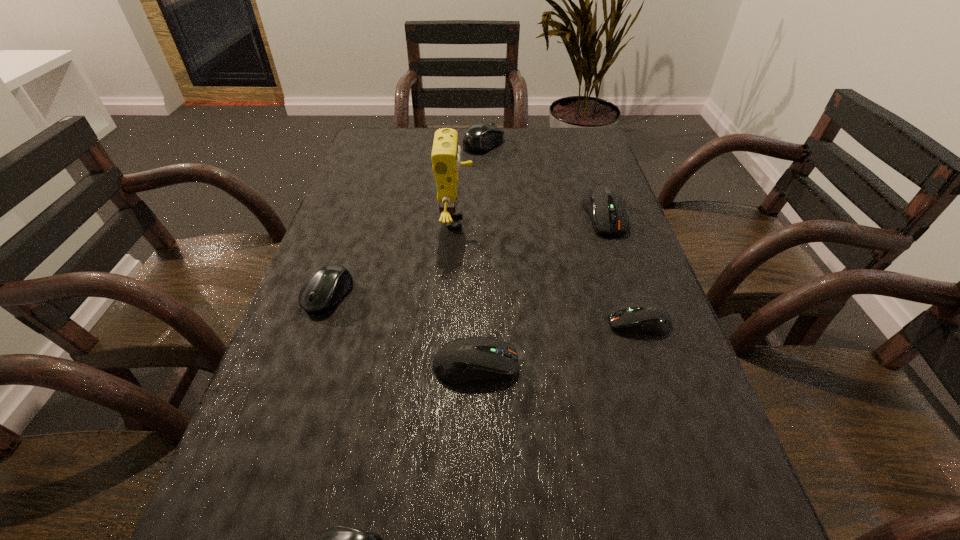
Locate which object is the sixth closest to the second black mouse from left to right. Please provide its 2D coordinates. Your answer should be formatted as a tuple, i.e. [(x, y)], where the tuple contains the x and y coordinates of a point satisfying the conditions above.

[(480, 137)]

Locate which object ranks sixth in proximity to the sponge. Please provide its 2D coordinates. Your answer should be formatted as a tuple, i.e. [(x, y)], where the tuple contains the x and y coordinates of a point satisfying the conditions above.

[(339, 539)]

Image resolution: width=960 pixels, height=540 pixels. What are the coordinates of `mouse that is the third nearest to the second nearest dark computer equipment` in the screenshot? It's located at 339,539.

Locate which mouse is the fourth closest to the tallest object. Please provide its 2D coordinates. Your answer should be formatted as a tuple, i.e. [(x, y)], where the tuple contains the x and y coordinates of a point satisfying the conditions above.

[(606, 207)]

The image size is (960, 540). Find the location of `black mouse that can be found as the second closest to the leftmost dark computer equipment`. black mouse that can be found as the second closest to the leftmost dark computer equipment is located at coordinates (339, 539).

At what (x,y) coordinates should I click in order to perform the action: click on the closest black mouse relative to the farthest object. Please return your answer as a coordinate pair (x, y). The height and width of the screenshot is (540, 960). Looking at the image, I should click on (326, 287).

Select which dark computer equipment appears as the second closest to the second farthest dark computer equipment. Please provide its 2D coordinates. Your answer should be formatted as a tuple, i.e. [(x, y)], where the tuple contains the x and y coordinates of a point satisfying the conditions above.

[(606, 207)]

Where is `dark computer equipment that can be found as the third closest to the sixth object from right to left`? The height and width of the screenshot is (540, 960). dark computer equipment that can be found as the third closest to the sixth object from right to left is located at coordinates (606, 207).

Where is `free space that satisfies the following two spatial constraints: 1. on the button of the biggest dark computer equipment; 2. on the face of the tallest object`? The height and width of the screenshot is (540, 960). free space that satisfies the following two spatial constraints: 1. on the button of the biggest dark computer equipment; 2. on the face of the tallest object is located at coordinates (607, 222).